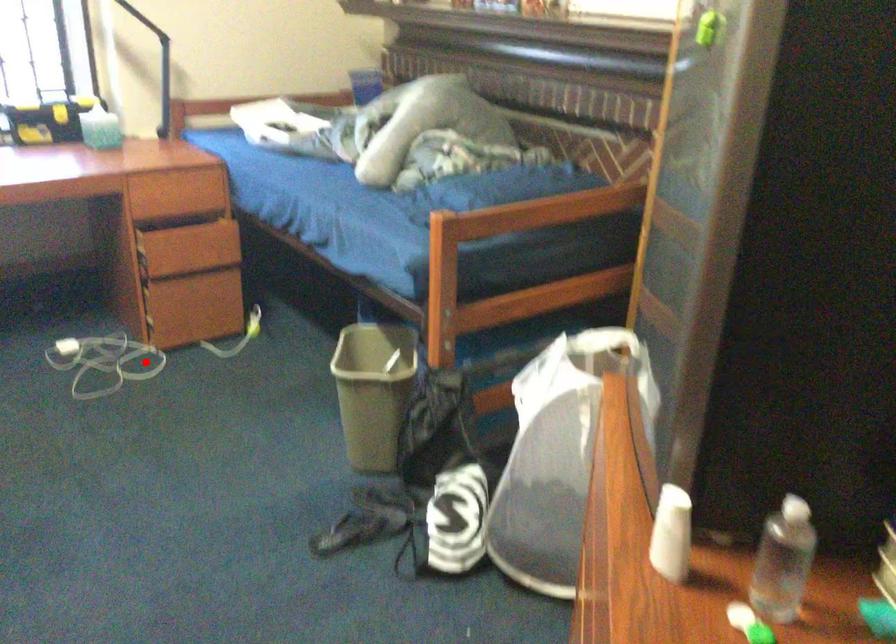
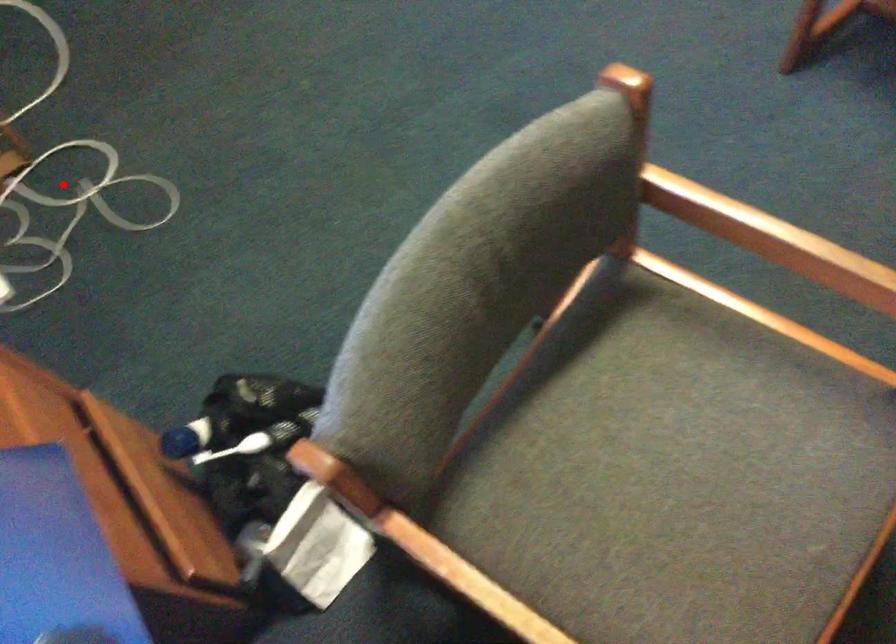
I am providing you with two images of the same scene from different viewpoints. A red point is marked on the first image and another point is marked on the second image. Is the marked point in image1 the same physical position as the marked point in image2?

Yes